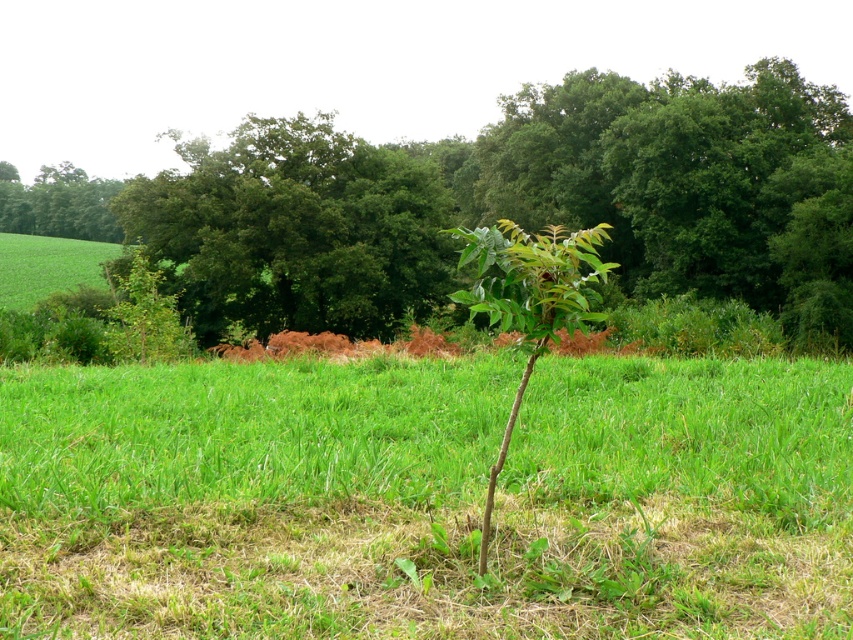
You are standing in the middle of the grassy field and see the green leafy plant at center and the green matte plant at center. Which one is positioned to the left?

The green leafy plant at center is to the left of the green matte plant at center.

You are a gardener who wants to water both the green leafy tree at center and the green matte plant at center. Since you can only reach up to 1.5 meters, will you be able to water both plants without needing a ladder?

The green leafy tree at center is above the green matte plant at center. Since the gardener can reach up to 1.5 meters, they can water both plants without needing a ladder as long as the height difference between them is within their reach.

You are a gardener standing in the field and want to water both the green leafy plant at center and the green leafy tree at center. Which one should you water first if you want to start with the closer one?

You should water the green leafy plant at center first because it is closer to you than the green leafy tree at center.